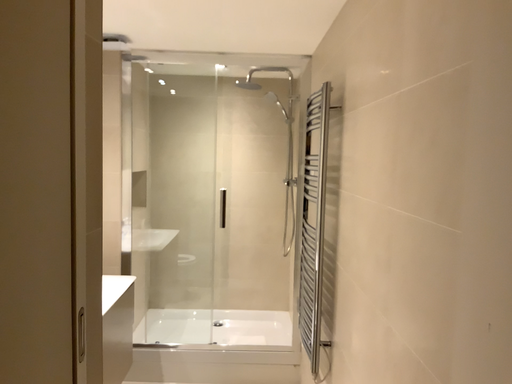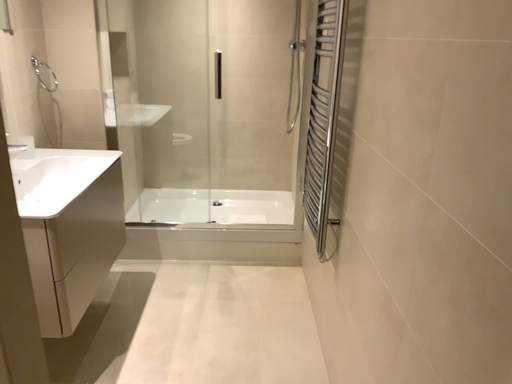
Question: Which way did the camera rotate in the video?

Choices:
 (A) rotated downward
 (B) rotated upward

Answer: (A)